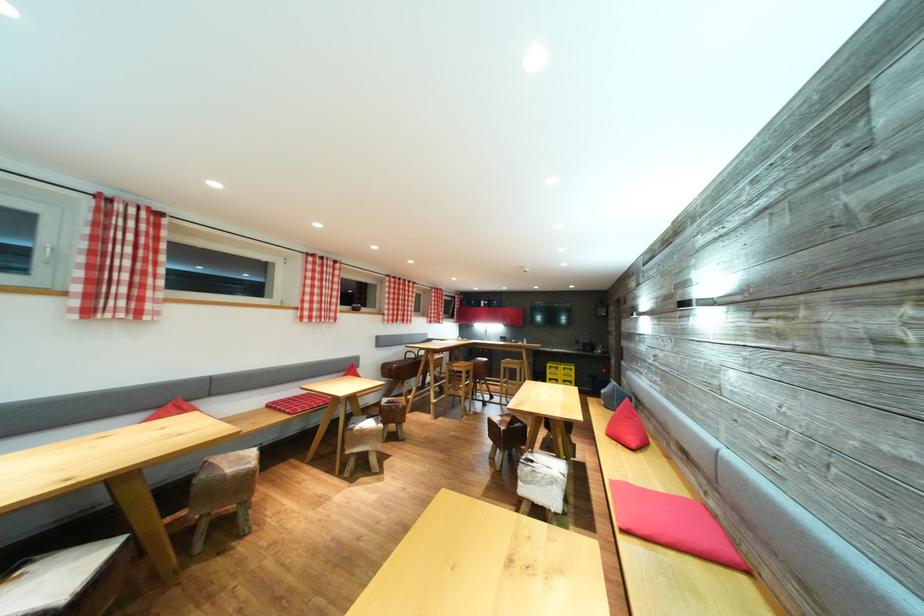
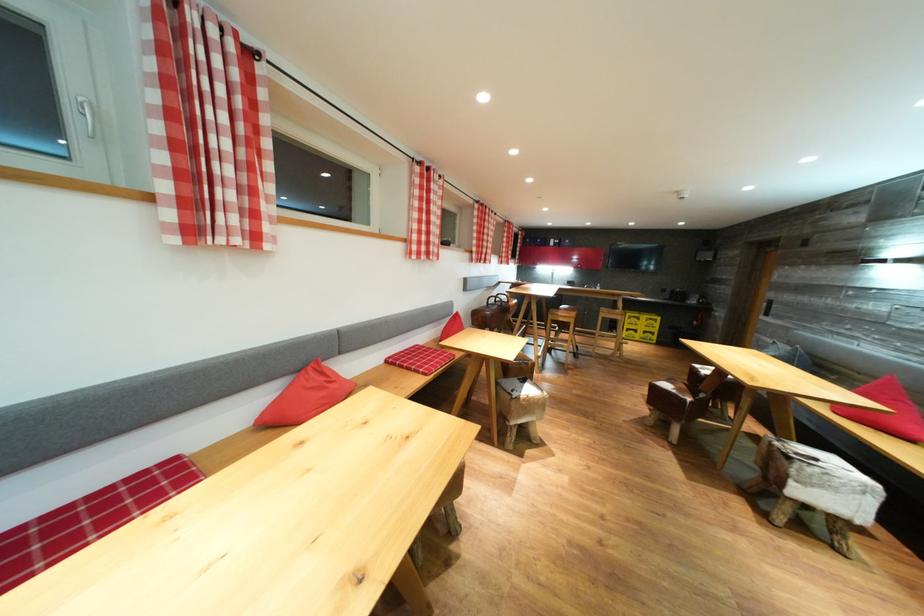
The point at (375, 430) is marked in the first image. Where is the corresponding point in the second image?

(536, 395)